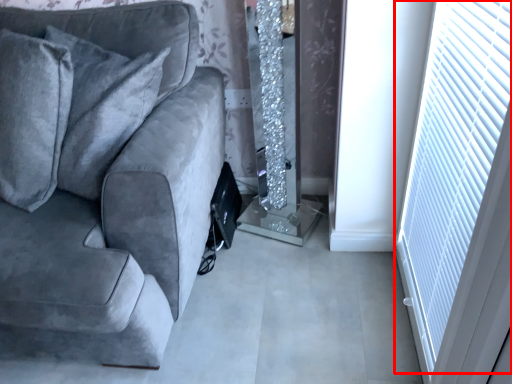
Question: From the image's perspective, considering the relative positions of blind (annotated by the red box) and studio couch in the image provided, where is blind (annotated by the red box) located with respect to the staircase?

Choices:
 (A) below
 (B) above

Answer: (A)